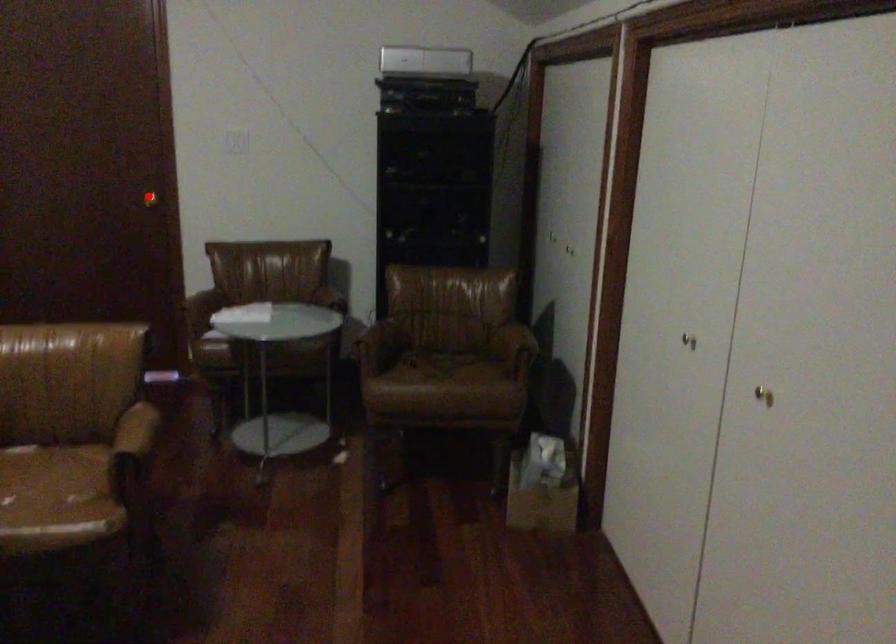
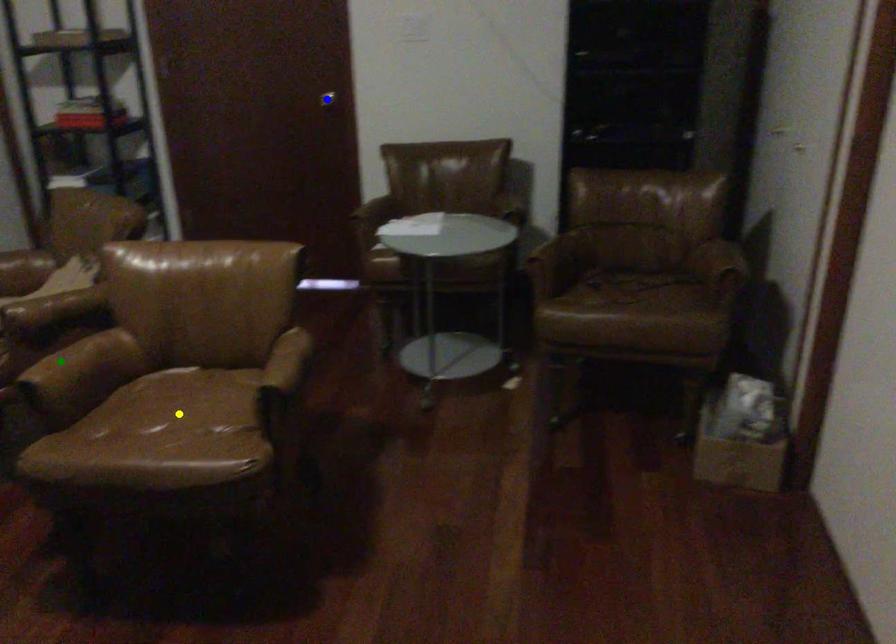
Question: I am providing you with two images of the same scene from different viewpoints. A red point is marked on the first image. You are given multiple points on the second image. In image 2, which mark is for the same physical point as the one in image 1?

Choices:
 (A) green point
 (B) yellow point
 (C) blue point

Answer: (C)